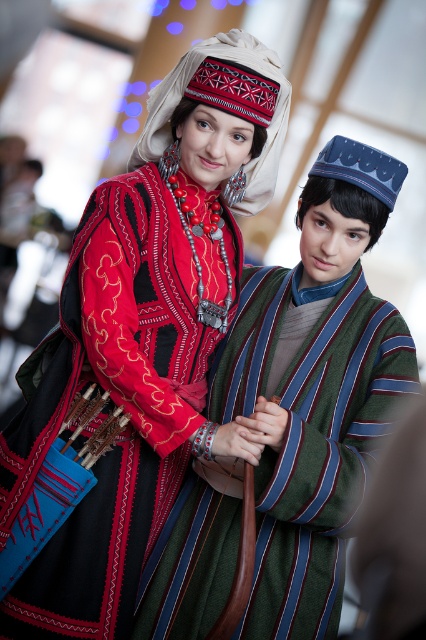
Is striped wool robe at center shorter than embroidered fabric headdress at upper center?

Incorrect, striped wool robe at center's height does not fall short of embroidered fabric headdress at upper center's.

The height and width of the screenshot is (640, 426). Describe the element at coordinates (322, 460) in the screenshot. I see `striped wool robe at center` at that location.

Which is in front, point (259, 294) or point (173, 80)?

Positioned in front is point (173, 80).

Locate an element on the screen. The height and width of the screenshot is (640, 426). striped wool robe at center is located at coordinates (322, 460).